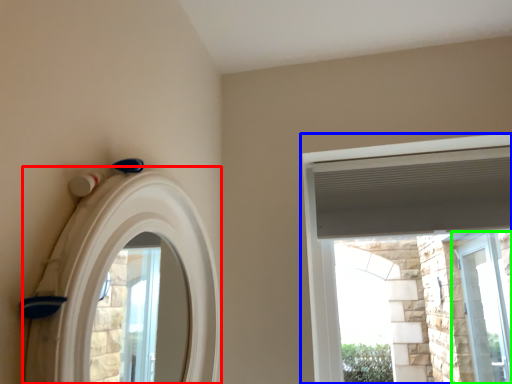
Question: Considering the real-world distances, which object is farthest from archway (highlighted by a red box)? window (highlighted by a blue box) or window (highlighted by a green box)?

Choices:
 (A) window
 (B) window

Answer: (B)